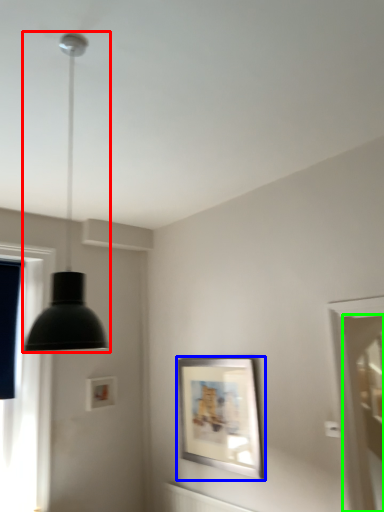
Question: Considering the real-world distances, which object is farthest from lamp (highlighted by a red box)? picture frame (highlighted by a blue box) or screen door (highlighted by a green box)?

Choices:
 (A) picture frame
 (B) screen door

Answer: (B)